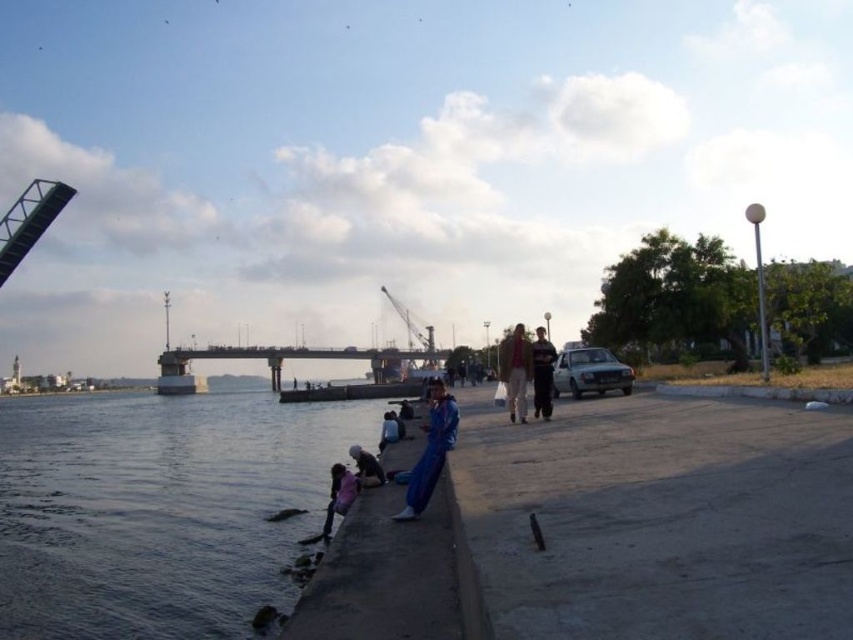
Is dark blue fabric at lower center to the right of light blue fabric at lower center from the viewer's perspective?

No, dark blue fabric at lower center is not to the right of light blue fabric at lower center.

Is point (352, 458) positioned in front of point (387, 433)?

That is True.

Identify the location of dark blue fabric at lower center. The height and width of the screenshot is (640, 853). (366, 467).

How distant is blue fabric pants at lower center from light brown leather jacket at center?

blue fabric pants at lower center is 19.60 meters away from light brown leather jacket at center.

Does blue fabric pants at lower center come behind light brown leather jacket at center?

A: No.

Is point (451, 419) positioned before point (518, 344)?

Yes, it is.

You are a GUI agent. You are given a task and a screenshot of the screen. Output one action in this format:
    pyautogui.click(x=<x>, y=<y>)
    Task: Click on the blue fabric pants at lower center
    This screenshot has height=640, width=853.
    Given the screenshot: What is the action you would take?
    pyautogui.click(x=430, y=451)

Does point (434, 355) come farther from viewer compared to point (503, 384)?

Yes, point (434, 355) is farther from viewer.

From the picture: Does concrete gray bridge at center have a larger size compared to light brown leather jacket at center?

Correct, concrete gray bridge at center is larger in size than light brown leather jacket at center.

Who is more distant from viewer, (199, 352) or (519, 337)?

The point (199, 352) is behind.

The height and width of the screenshot is (640, 853). I want to click on concrete gray bridge at center, so click(x=280, y=362).